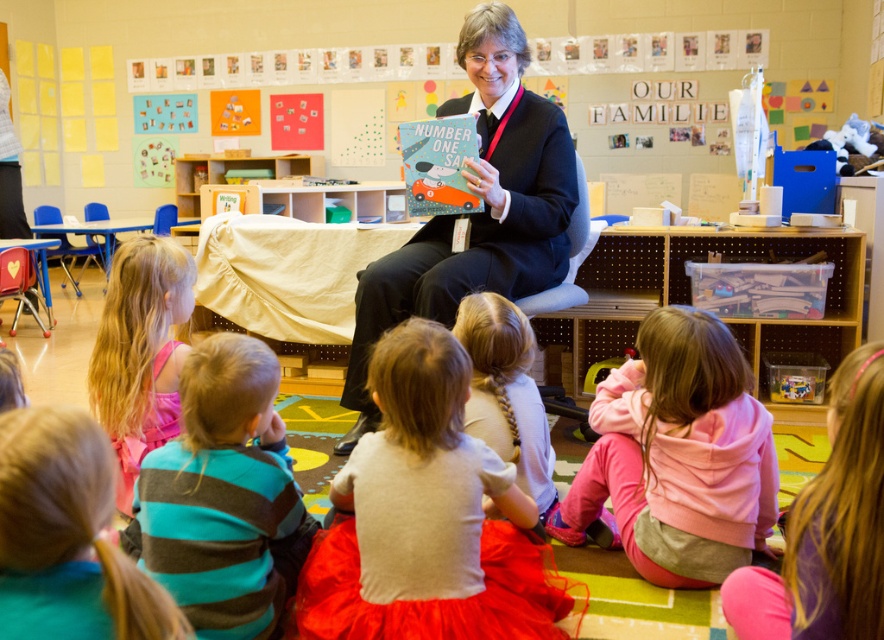
Question: Which object is positioned farthest from the pink fleece jacket at lower right?

Choices:
 (A) striped cotton shirt at lower left
 (B) matte black suit at center

Answer: (B)

Question: Is matte black suit at center closer to the viewer compared to light brown hair at center?

Choices:
 (A) no
 (B) yes

Answer: (A)

Question: Among these points, which one is farthest from the camera?

Choices:
 (A) pyautogui.click(x=703, y=436)
 (B) pyautogui.click(x=507, y=6)
 (C) pyautogui.click(x=254, y=410)
 (D) pyautogui.click(x=565, y=636)

Answer: (B)

Question: Which object is positioned farthest from the pink fleece hoodie at lower right?

Choices:
 (A) light brown hair at center
 (B) white cotton tutu at center
 (C) blonde hair at lower left

Answer: (C)

Question: Is matte black suit at center below light brown hair at center?

Choices:
 (A) yes
 (B) no

Answer: (B)

Question: Can you confirm if pink fleece jacket at lower right is thinner than teal striped shirt at lower left?

Choices:
 (A) yes
 (B) no

Answer: (A)